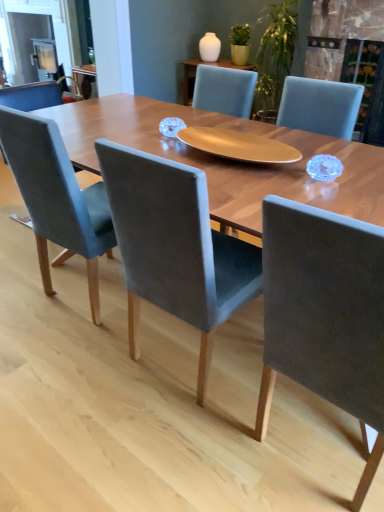
Identify the location of vacant space in front of velvet grey chair at left, the 1th chair when ordered from left to right. Image resolution: width=384 pixels, height=512 pixels. (71, 357).